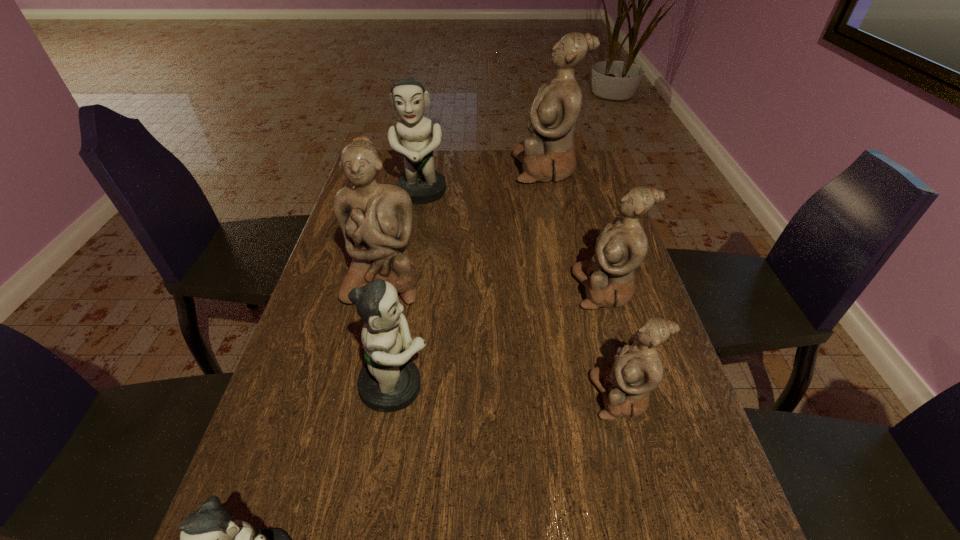
The height and width of the screenshot is (540, 960). Identify the location of the farthest white figurine. (548, 154).

Where is `the tallest figurine`? Image resolution: width=960 pixels, height=540 pixels. the tallest figurine is located at coordinates (548, 154).

Identify the location of the biggest green figurine. The image size is (960, 540). (424, 185).

This screenshot has height=540, width=960. Find the location of `the leftmost white figurine`. the leftmost white figurine is located at coordinates (376, 219).

Image resolution: width=960 pixels, height=540 pixels. I want to click on the second farthest green figurine, so coord(389,381).

This screenshot has width=960, height=540. I want to click on the third biggest white figurine, so click(x=621, y=247).

This screenshot has width=960, height=540. I want to click on the nearest white figurine, so click(x=637, y=369).

Where is `blank space located on the front-facing side of the farthest white figurine`? blank space located on the front-facing side of the farthest white figurine is located at coordinates (442, 169).

Locate an element on the screen. The height and width of the screenshot is (540, 960). vacant region located on the front-facing side of the farthest white figurine is located at coordinates (412, 169).

Find the location of a particular element. vacant space located 0.130m on the front-facing side of the farthest white figurine is located at coordinates click(477, 169).